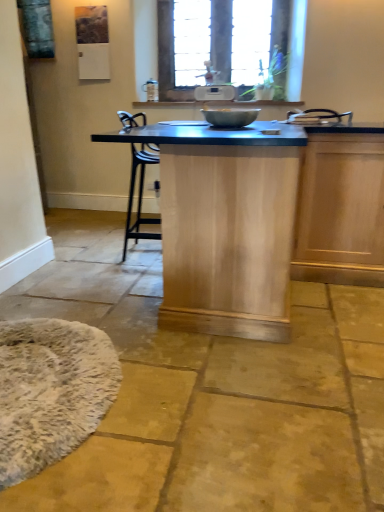
This screenshot has height=512, width=384. I want to click on vacant area that is situated to the right of white fluffy mat at lower left, so click(x=206, y=404).